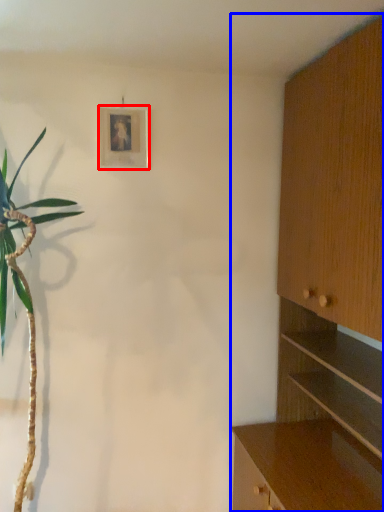
Question: Which point is further to the camera, picture frame (highlighted by a red box) or cabinetry (highlighted by a blue box)?

Choices:
 (A) picture frame
 (B) cabinetry

Answer: (A)